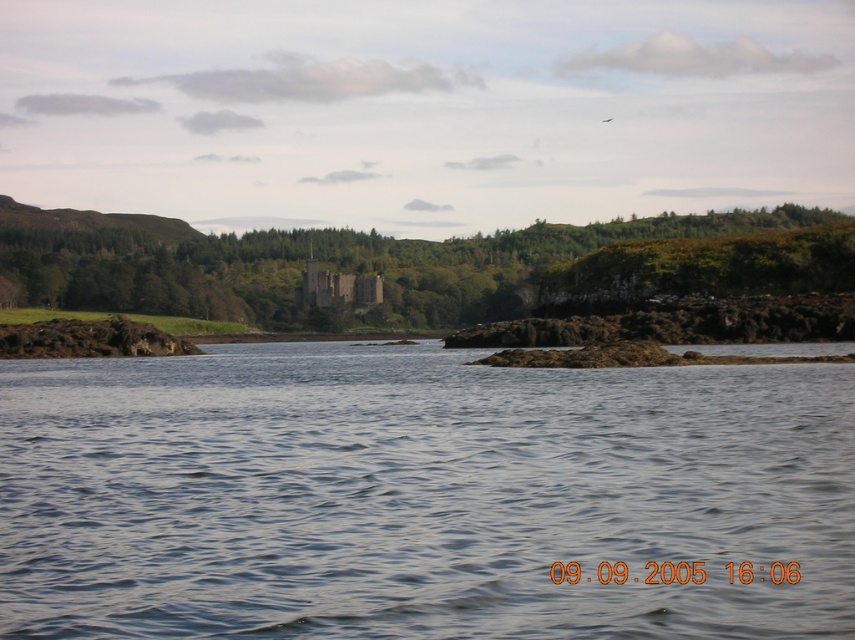
Which of these two, clear water at center or green leafy tree at center, stands taller?

green leafy tree at center is taller.

Is clear water at center closer to camera compared to green leafy tree at center?

Yes, it is.

Between point (428, 426) and point (547, 244), which one is positioned in front?

Point (428, 426) is in front.

Locate an element on the screen. The image size is (855, 640). clear water at center is located at coordinates (419, 497).